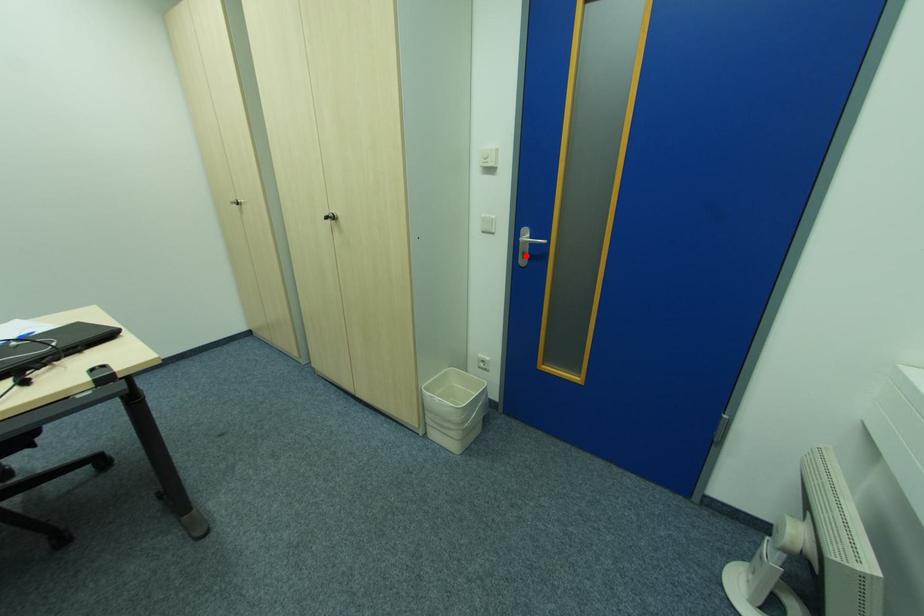
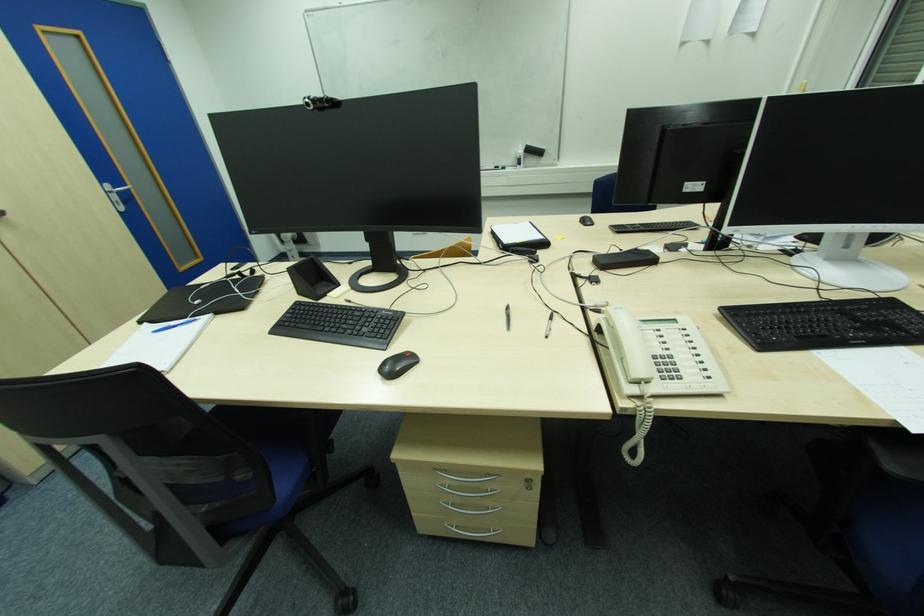
Locate, in the second image, the point that corresponds to the highlighted location in the first image.

(119, 204)